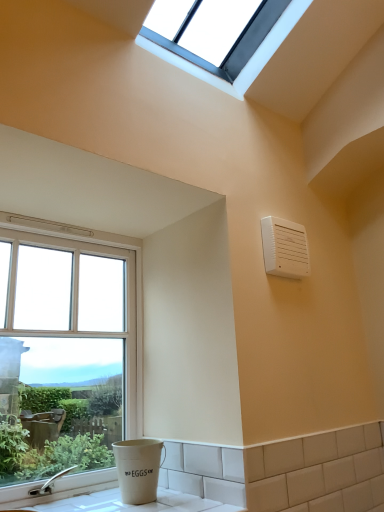
Question: Considering the relative sizes of white plastic air conditioning unit at upper right and clear glass window at upper center, positioned as the 2th window in left-to-right order, in the image provided, is white plastic air conditioning unit at upper right smaller than clear glass window at upper center, positioned as the 2th window in left-to-right order,?

Choices:
 (A) no
 (B) yes

Answer: (B)

Question: From a real-world perspective, is white plastic air conditioning unit at upper right physically below clear glass window at upper center, the 1th window positioned from the right?

Choices:
 (A) no
 (B) yes

Answer: (B)

Question: Is white plastic air conditioning unit at upper right looking in the opposite direction of clear glass window at upper center, the 2th window in the bottom-to-top sequence?

Choices:
 (A) yes
 (B) no

Answer: (B)

Question: Is the depth of white plastic air conditioning unit at upper right less than that of clear glass window at upper center, the first window positioned from the top?

Choices:
 (A) yes
 (B) no

Answer: (B)

Question: From the image's perspective, would you say white plastic air conditioning unit at upper right is positioned over clear glass window at upper center, the 1th window positioned from the right?

Choices:
 (A) yes
 (B) no

Answer: (B)

Question: Considering the positions of clear glass window at upper center, positioned as the 2th window in left-to-right order, and white ceramic counter top at lower left in the image, is clear glass window at upper center, positioned as the 2th window in left-to-right order, taller or shorter than white ceramic counter top at lower left?

Choices:
 (A) short
 (B) tall

Answer: (B)

Question: Based on their sizes in the image, would you say clear glass window at upper center, the 2th window in the bottom-to-top sequence, is bigger or smaller than white ceramic counter top at lower left?

Choices:
 (A) small
 (B) big

Answer: (B)

Question: Is clear glass window at upper center, the 1th window positioned from the right, inside or outside of white ceramic counter top at lower left?

Choices:
 (A) outside
 (B) inside

Answer: (A)

Question: Is clear glass window at upper center, the 2th window in the bottom-to-top sequence, in front of or behind white ceramic counter top at lower left in the image?

Choices:
 (A) behind
 (B) front

Answer: (A)

Question: From a real-world perspective, relative to clear glass window at left, placed as the first window when sorted from bottom to top, is white ceramic counter top at lower left vertically above or below?

Choices:
 (A) below
 (B) above

Answer: (A)

Question: From the image's perspective, is white ceramic counter top at lower left positioned above or below clear glass window at left, placed as the first window when sorted from bottom to top?

Choices:
 (A) below
 (B) above

Answer: (A)

Question: Is white ceramic counter top at lower left to the left or to the right of clear glass window at left, placed as the first window when sorted from bottom to top, in the image?

Choices:
 (A) right
 (B) left

Answer: (A)

Question: In terms of height, does white ceramic counter top at lower left look taller or shorter compared to clear glass window at left, the 1th window in the left-to-right sequence?

Choices:
 (A) short
 (B) tall

Answer: (A)

Question: Visually, is clear glass window at left, placed as the 2th window when sorted from right to left, positioned to the left or to the right of white plastic air conditioning unit at upper right?

Choices:
 (A) right
 (B) left

Answer: (B)

Question: In terms of height, does clear glass window at left, placed as the 2th window when sorted from right to left, look taller or shorter compared to white plastic air conditioning unit at upper right?

Choices:
 (A) tall
 (B) short

Answer: (A)